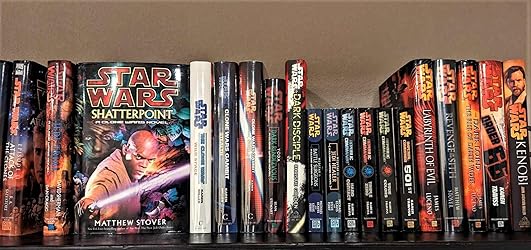
You are a GUI agent. You are given a task and a screenshot of the screen. Output one action in this format:
    pyautogui.click(x=<x>, y=<y>)
    Task: Click on the wall
    The image size is (531, 250).
    Given the screenshot: What is the action you would take?
    pyautogui.click(x=359, y=20)